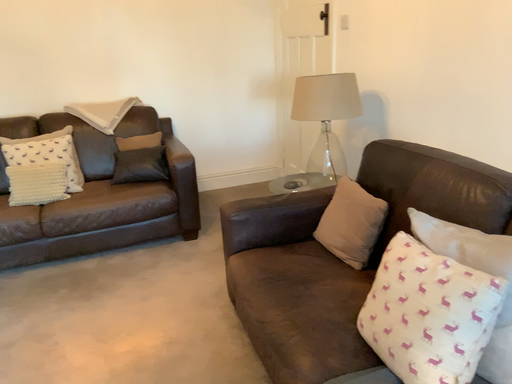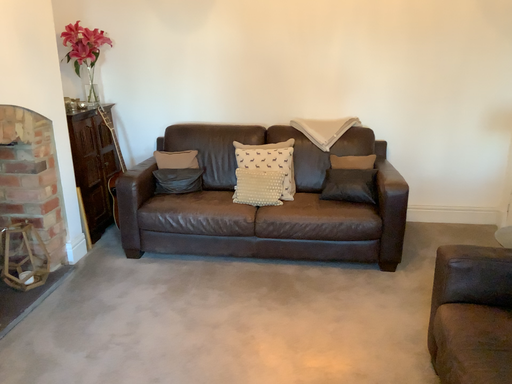
Question: Which way did the camera rotate in the video?

Choices:
 (A) rotated right
 (B) rotated left

Answer: (B)